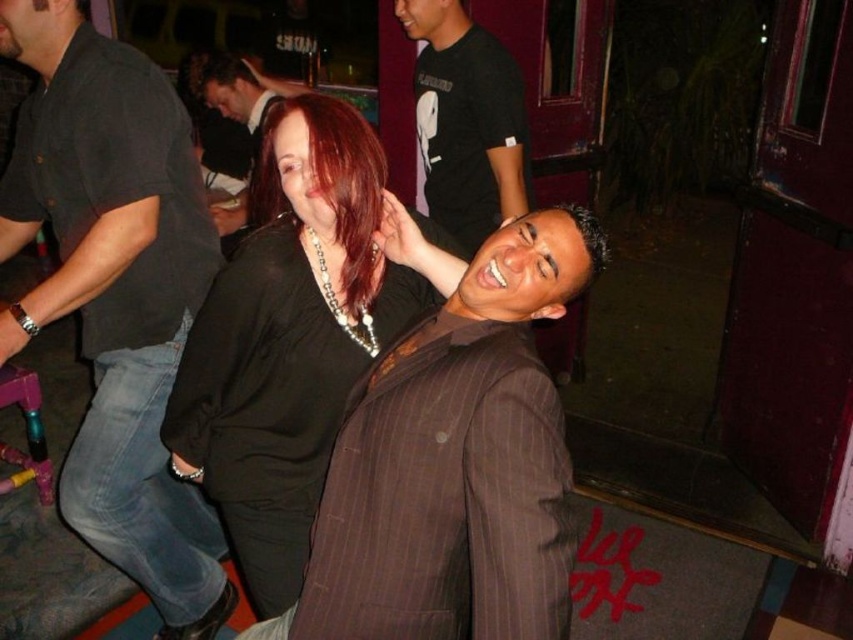
Which is below, shiny black shirt at center or dark red hair at center?

shiny black shirt at center

Where is `shiny black shirt at center`? This screenshot has width=853, height=640. shiny black shirt at center is located at coordinates (294, 333).

At what (x,y) coordinates should I click in order to perform the action: click on shiny black shirt at center. Please return your answer as a coordinate pair (x, y). This screenshot has height=640, width=853. Looking at the image, I should click on (294, 333).

Is dark gray shirt at center below black cotton t-shirt at upper center?

Correct, dark gray shirt at center is located below black cotton t-shirt at upper center.

Identify the location of dark gray shirt at center. (115, 291).

Where is `dark gray shirt at center`? dark gray shirt at center is located at coordinates (115, 291).

Is dark gray shirt at center in front of matte black shirt at upper center?

That is True.

Where is `dark gray shirt at center`? dark gray shirt at center is located at coordinates (115, 291).